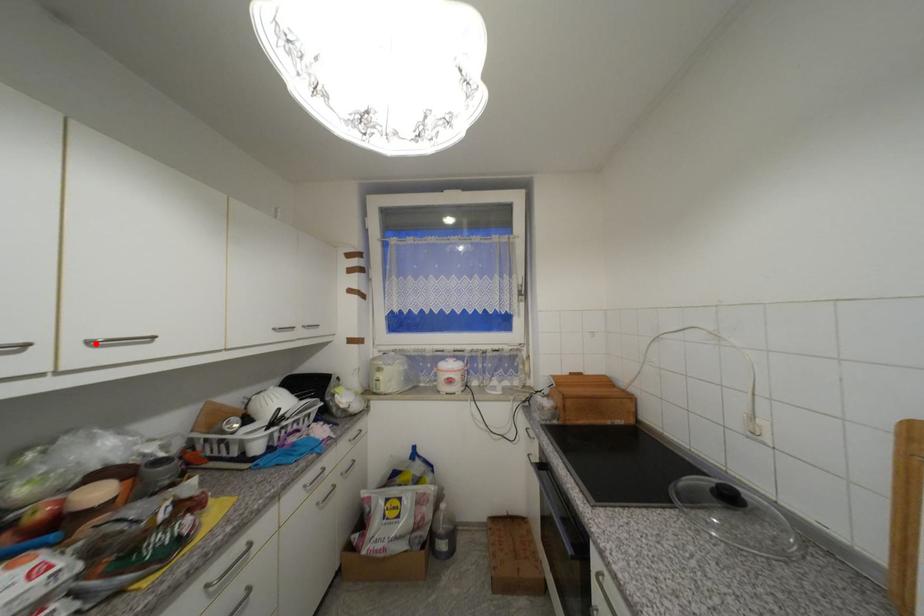
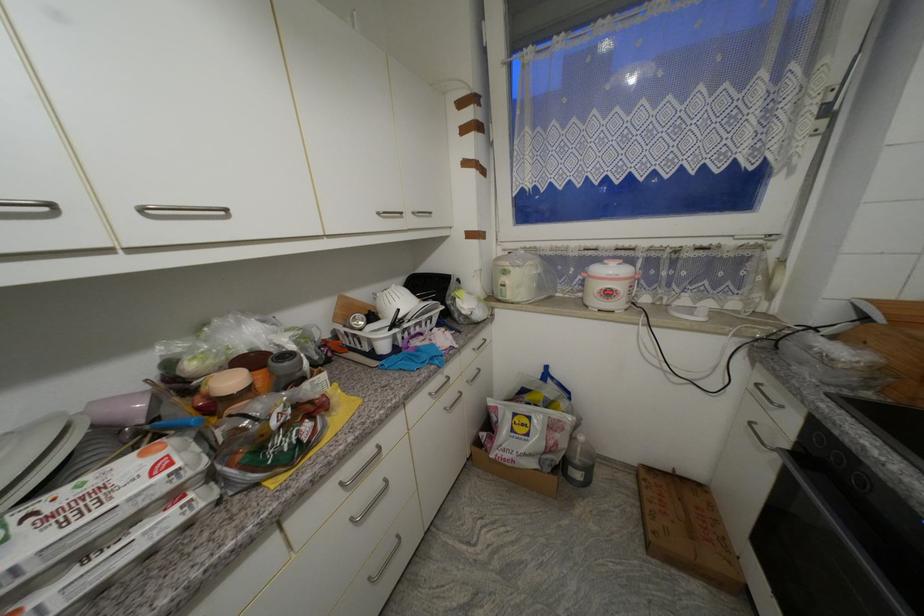
The point at the highlighted location is marked in the first image. Where is the corresponding point in the second image?

(149, 211)